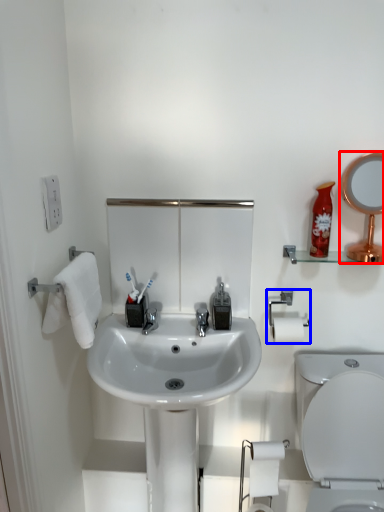
Question: Which point is further to the camera, mirror (highlighted by a red box) or towel bar (highlighted by a blue box)?

Choices:
 (A) mirror
 (B) towel bar

Answer: (B)